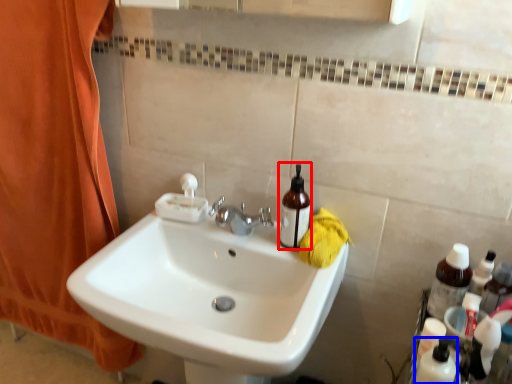
Question: Which object appears closest to the camera in this image, mouthwash (highlighted by a red box) or toiletry (highlighted by a blue box)?

Choices:
 (A) mouthwash
 (B) toiletry

Answer: (B)